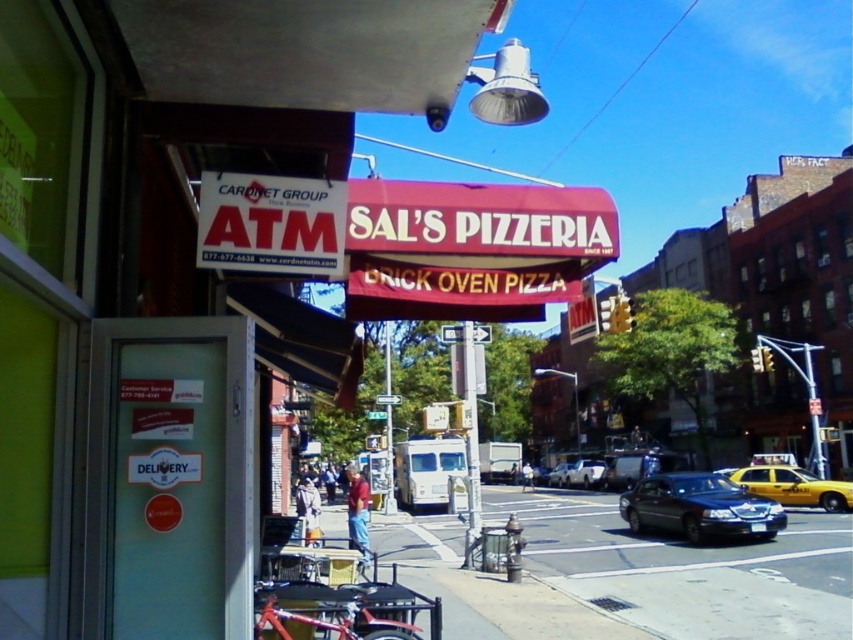
You are a delivery driver who needs to park your yellow matte taxi at lower right near Sal s Pizzeria. However, there is a red brick oven pizza at center blocking the path. Can you drive your taxi around it without going too far out of your way?

The red brick oven pizza at center is taller than yellow matte taxi at lower right, so it might obstruct the path. However, since the taxi is at lower right and the pizza sign is at center, you can drive around it by moving to the left or right along the street while staying close to the storefront to avoid detouring too far.

You are driving a shiny black sedan at center and need to park it on the smooth asphalt road at center. Is there enough space for the sedan to fit on the road?

The smooth asphalt road at center is in front of the shiny black sedan at center, indicating that the road extends beyond the sedan. Since the road is at the center and the sedan is also at the center, there should be sufficient space for the sedan to park on the smooth asphalt road at center.

You are a delivery person who needs to place a pizza box on the hood of the car. The pizza box must not exceed the car hood size. Given the pizza box size is the same as the red brick oven pizza at center, will the pizza box fit on the hood of the black glossy sedan at center?

The red brick oven pizza at center has a smaller size compared to black glossy sedan at center. Since the pizza box size matches the pizza, it will fit on the hood of the black glossy sedan at center without exceeding its size.